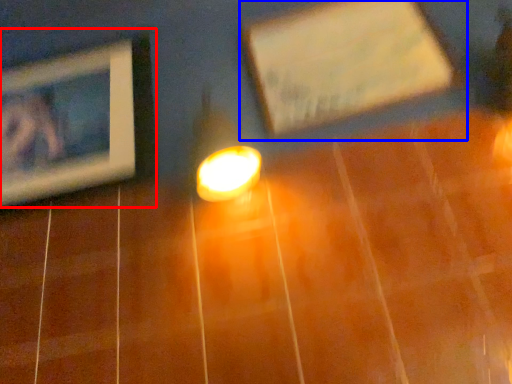
Question: Which object appears closest to the camera in this image, picture frame (highlighted by a red box) or picture frame (highlighted by a blue box)?

Choices:
 (A) picture frame
 (B) picture frame

Answer: (B)